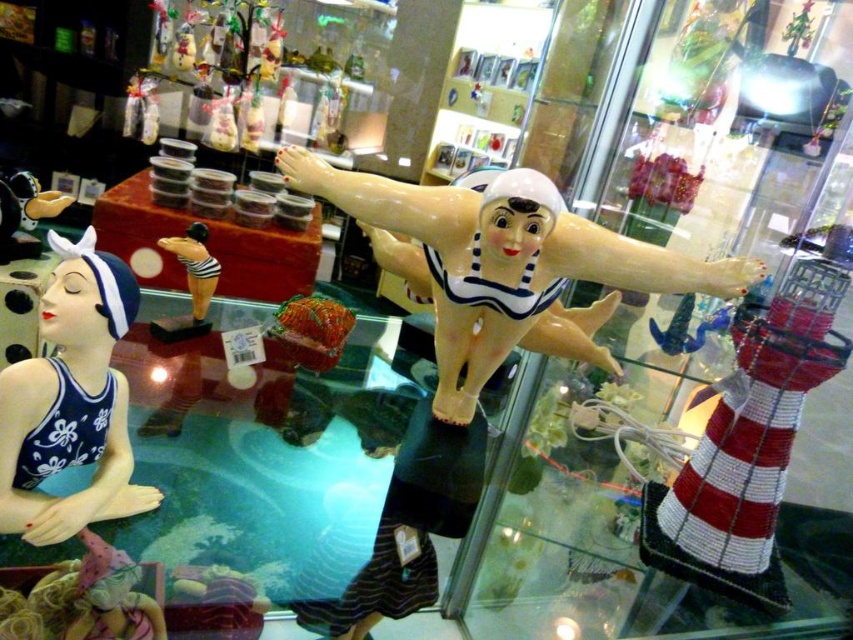
Question: Which object appears farthest from the camera in this image?

Choices:
 (A) blue glossy swimsuit at left
 (B) matte black swimsuit at center

Answer: (B)

Question: Can you confirm if red and white beaded lighthouse at center is wider than matte black rubber duck at upper left?

Choices:
 (A) yes
 (B) no

Answer: (A)

Question: From the image, what is the correct spatial relationship of blue glossy swimsuit at left in relation to matte black swimsuit at center?

Choices:
 (A) above
 (B) below

Answer: (B)

Question: Which point appears farthest from the camera in this image?

Choices:
 (A) (65, 205)
 (B) (119, 260)
 (C) (198, 262)

Answer: (C)

Question: Which is farther from the matte black rubber duck at upper left?

Choices:
 (A) red and white beaded lighthouse at center
 (B) blue glossy swimsuit at left

Answer: (A)

Question: Can you confirm if red and white beaded lighthouse at center is bigger than blue glossy swimsuit at left?

Choices:
 (A) no
 (B) yes

Answer: (B)